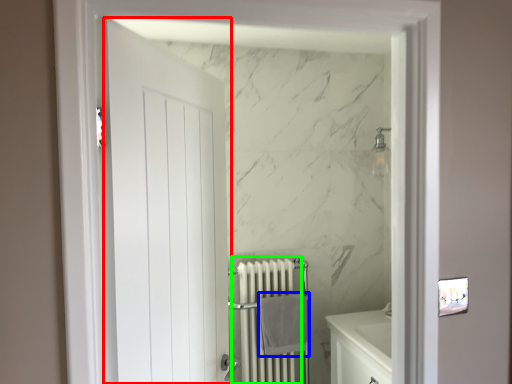
Question: Which object is positioned closest to door (highlighted by a red box)? Select from bath towel (highlighted by a blue box) and radiator (highlighted by a green box).

Choices:
 (A) bath towel
 (B) radiator

Answer: (A)